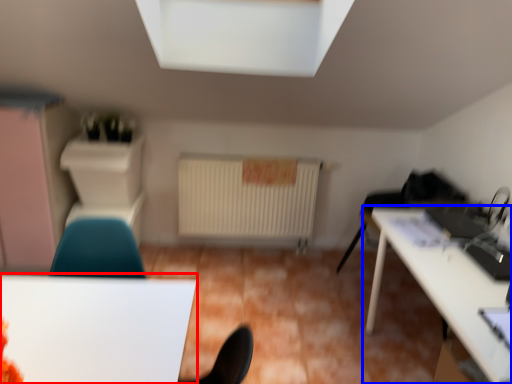
Question: Which point is further to the camera, table (highlighted by a red box) or table (highlighted by a blue box)?

Choices:
 (A) table
 (B) table

Answer: (B)